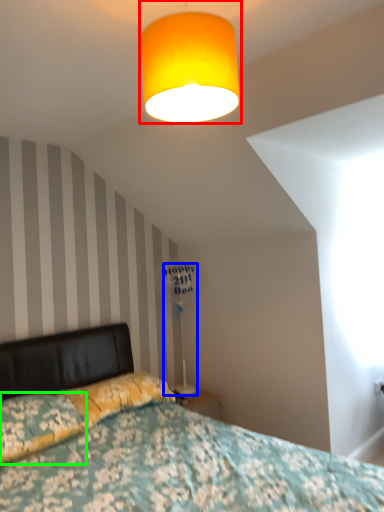
Question: Considering the real-world distances, which object is closest to lamp (highlighted by a red box)? table lamp (highlighted by a blue box) or pillow (highlighted by a green box).

Choices:
 (A) table lamp
 (B) pillow

Answer: (B)